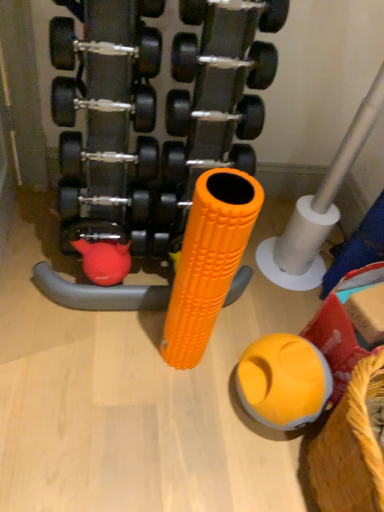
Where is `vacant space in between rubberized yellow ball at lower right and black rubber dumbbell at center`? This screenshot has height=512, width=384. vacant space in between rubberized yellow ball at lower right and black rubber dumbbell at center is located at coordinates (164, 355).